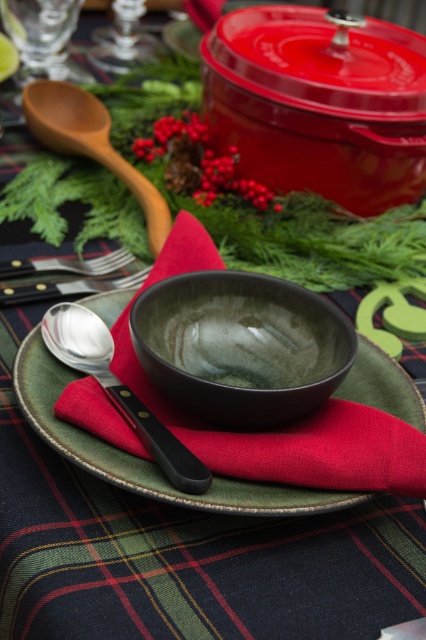
You are a guest at a holiday dinner and need to place your napkin on the table. The host mentioned that the napkin should be placed exactly at the coordinates provided. Where should you place your napkin relative to the green glazed bowl at center?

The green glazed bowl at center is located at coordinates point (241, 346), so you should place your napkin exactly at those coordinates.

You are sitting at the festive table and want to reach for an item. You notice two points on the tablecloth marked as point 1 at coordinates point (160,499) and point 2 at coordinates point (97,320). Which point is closer to you, point 1 or point 2?

Point 1 at coordinates point (160,499) is closer to you because it is in front of point 2 at coordinates point (97,320).

You are standing at the edge of the table looking towards the festive table setting. There are two points marked on the table surface. Which point, point 1 at coordinates (167, 344) or point 2 at coordinates (117, 280), is closer to you?

Point 1 at coordinates (167, 344) is closer to you than point 2 at coordinates (117, 280).